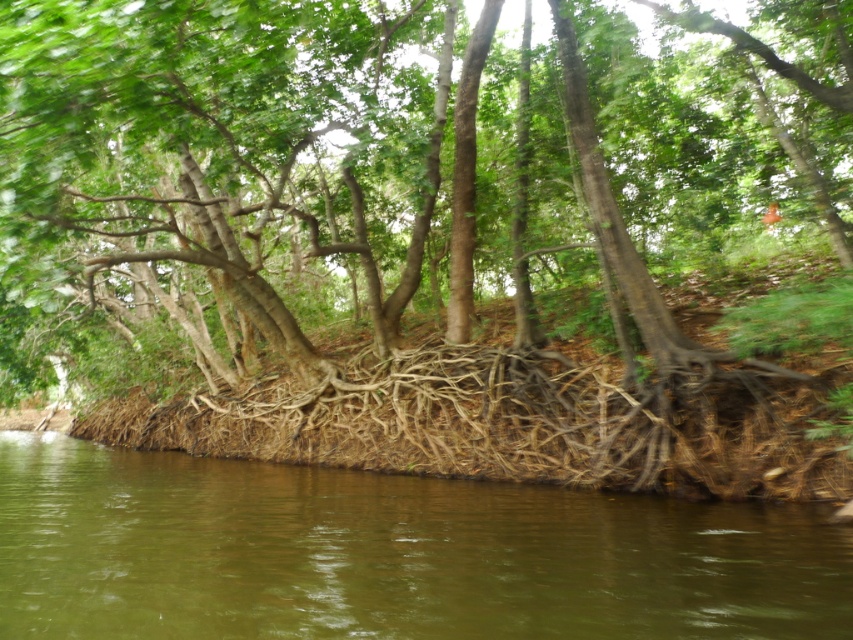
Question: Can you confirm if brown rough roots at center is positioned above brown muddy water at lower center?

Choices:
 (A) no
 (B) yes

Answer: (B)

Question: From the image, what is the correct spatial relationship of brown rough roots at center in relation to brown muddy water at lower center?

Choices:
 (A) below
 (B) above

Answer: (B)

Question: Which point is farther to the camera?

Choices:
 (A) (328, 93)
 (B) (270, 541)

Answer: (A)

Question: Which point is closer to the camera?

Choices:
 (A) brown muddy water at lower center
 (B) brown rough roots at center

Answer: (A)

Question: Is brown rough roots at center bigger than brown muddy water at lower center?

Choices:
 (A) no
 (B) yes

Answer: (B)